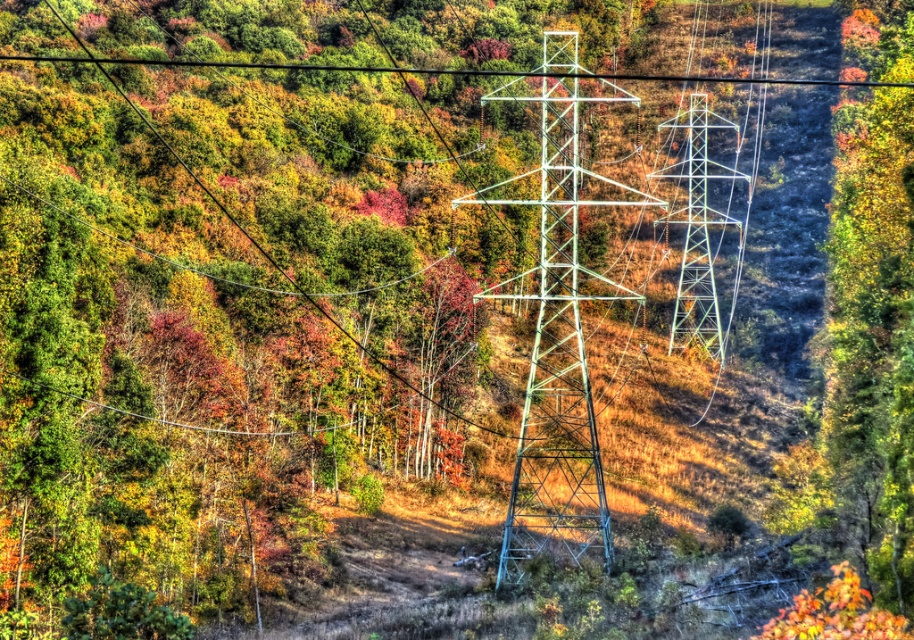
Question: Which object is farther from the camera taking this photo?

Choices:
 (A) green metallic tower at center
 (B) metallic silver tower at center

Answer: (B)

Question: Does green metallic tower at center lie in front of metallic silver tower at center?

Choices:
 (A) yes
 (B) no

Answer: (A)

Question: Does green metallic tower at center have a larger size compared to metallic silver tower at center?

Choices:
 (A) yes
 (B) no

Answer: (A)

Question: Among these points, which one is farthest from the camera?

Choices:
 (A) (575, 36)
 (B) (673, 147)

Answer: (B)

Question: Can you confirm if green metallic tower at center is thinner than metallic silver tower at center?

Choices:
 (A) yes
 (B) no

Answer: (B)